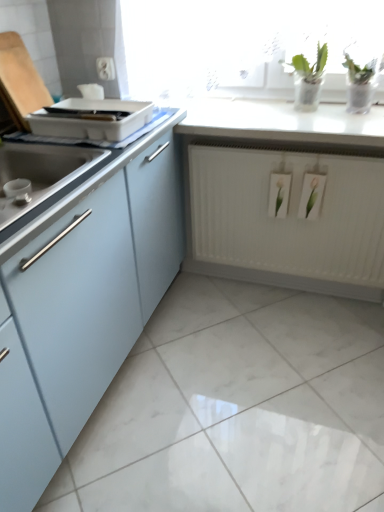
Image resolution: width=384 pixels, height=512 pixels. Describe the element at coordinates (77, 288) in the screenshot. I see `matte light blue cabinet at left` at that location.

At what (x,y) coordinates should I click in order to perform the action: click on matte light blue cabinet at left. Please return your answer as a coordinate pair (x, y). The image size is (384, 512). Looking at the image, I should click on (77, 288).

Between white plastic tray at upper left and white matte radiator at center, which one has larger width?

With larger width is white plastic tray at upper left.

From a real-world perspective, is white plastic tray at upper left below white matte radiator at center?

No.

Is white plastic tray at upper left facing away from white matte radiator at center?

white plastic tray at upper left is not turned away from white matte radiator at center.

Considering the sizes of matte light blue cabinet at left and white glossy countertop at upper center in the image, is matte light blue cabinet at left bigger or smaller than white glossy countertop at upper center?

Clearly, matte light blue cabinet at left is larger in size than white glossy countertop at upper center.

How much distance is there between matte light blue cabinet at left and white glossy countertop at upper center?

They are 26.23 inches apart.

Between matte light blue cabinet at left and white glossy countertop at upper center, which one appears on the right side from the viewer's perspective?

Positioned to the right is white glossy countertop at upper center.

Does matte light blue cabinet at left turn towards white glossy countertop at upper center?

Yes.

How different are the orientations of white matte radiator at center and white glossy countertop at upper center in degrees?

They differ by 1.72 degrees in their facing directions.

Who is shorter, white matte radiator at center or white glossy countertop at upper center?

Standing shorter between the two is white glossy countertop at upper center.

Which of these two, white matte radiator at center or white glossy countertop at upper center, is bigger?

With larger size is white matte radiator at center.

You are a GUI agent. You are given a task and a screenshot of the screen. Output one action in this format:
    pyautogui.click(x=<x>, y=<y>)
    Task: Click on the radiator that is under the white glossy countertop at upper center (from a real-world perspective)
    The height and width of the screenshot is (512, 384).
    Given the screenshot: What is the action you would take?
    pyautogui.click(x=286, y=220)

Based on the photo, from their relative heights in the image, would you say white plastic electric outlet at upper center is taller or shorter than white glossy countertop at upper center?

white plastic electric outlet at upper center is taller than white glossy countertop at upper center.

Is white plastic electric outlet at upper center wider than white glossy countertop at upper center?

In fact, white plastic electric outlet at upper center might be narrower than white glossy countertop at upper center.

Where is `countertop in front of the white plastic electric outlet at upper center`? The height and width of the screenshot is (512, 384). countertop in front of the white plastic electric outlet at upper center is located at coordinates (282, 122).

From the image's perspective, between white matte radiator at center and white plastic tray at upper left, which one is located above?

white plastic tray at upper left is shown above in the image.

Which is nearer, (206, 223) or (107, 140)?

Point (206, 223) is farther from the camera than point (107, 140).

From a real-world perspective, which object rests below the other?

Result: From a 3D spatial view, white matte radiator at center is below.

Is white matte radiator at center outside of white plastic tray at upper left?

white matte radiator at center lies outside white plastic tray at upper left's area.

Is point (99, 129) positioned after point (366, 118)?

No.

Between white plastic tray at upper left and white glossy countertop at upper center, which one appears on the left side from the viewer's perspective?

white plastic tray at upper left is more to the left.

Considering the sizes of objects white plastic tray at upper left and white glossy countertop at upper center in the image provided, who is taller, white plastic tray at upper left or white glossy countertop at upper center?

Standing taller between the two is white plastic tray at upper left.

How different are the orientations of white plastic tray at upper left and white glossy countertop at upper center in degrees?

The angle between the facing direction of white plastic tray at upper left and the facing direction of white glossy countertop at upper center is 89.2 degrees.

From a real-world perspective, is white matte radiator at center below matte light blue cabinet at left?

Yes, from a real-world perspective, white matte radiator at center is below matte light blue cabinet at left.

This screenshot has height=512, width=384. In order to click on radiator above the matte light blue cabinet at left (from the image's perspective) in this screenshot , I will do `click(286, 220)`.

Considering the relative sizes of white matte radiator at center and matte light blue cabinet at left in the image provided, is white matte radiator at center wider than matte light blue cabinet at left?

No, white matte radiator at center is not wider than matte light blue cabinet at left.

Is white matte radiator at center beside matte light blue cabinet at left?

white matte radiator at center and matte light blue cabinet at left are clearly separated.

Where is `radiator behind the white plastic tray at upper left`? This screenshot has height=512, width=384. radiator behind the white plastic tray at upper left is located at coordinates (286, 220).

Where is `cabinetry beneath the white glossy countertop at upper center (from a real-world perspective)`? This screenshot has height=512, width=384. cabinetry beneath the white glossy countertop at upper center (from a real-world perspective) is located at coordinates (77, 288).

Considering their positions, is white plastic electric outlet at upper center positioned further to white glossy countertop at upper center than white matte radiator at center?

The object further to white glossy countertop at upper center is white plastic electric outlet at upper center.

From the image, which object appears to be nearer to white plastic electric outlet at upper center, white glossy countertop at upper center or white plastic tray at upper left?

white plastic tray at upper left lies closer to white plastic electric outlet at upper center than the other object.

Looking at this image, looking at the image, which one is located further to white glossy countertop at upper center, white matte radiator at center or white plastic tray at upper left?

white plastic tray at upper left is positioned further to the anchor white glossy countertop at upper center.

Considering their positions, is white matte radiator at center positioned further to white plastic tray at upper left than white plastic electric outlet at upper center?

white matte radiator at center.

Consider the image. Based on their spatial positions, is white matte radiator at center or white glossy countertop at upper center further from matte light blue cabinet at left?

white matte radiator at center is positioned further to the anchor matte light blue cabinet at left.

Looking at the image, which one is located further to matte light blue cabinet at left, white matte radiator at center or white plastic electric outlet at upper center?

Among the two, white plastic electric outlet at upper center is located further to matte light blue cabinet at left.

Estimate the real-world distances between objects in this image. Which object is closer to white matte radiator at center, white glossy countertop at upper center or white plastic electric outlet at upper center?

white glossy countertop at upper center.

Based on their spatial positions, is matte light blue cabinet at left or white glossy countertop at upper center further from white plastic tray at upper left?

white glossy countertop at upper center is positioned further to the anchor white plastic tray at upper left.

In order to click on appliance positioned between matte light blue cabinet at left and white plastic electric outlet at upper center from near to far in this screenshot , I will do `click(91, 119)`.

Image resolution: width=384 pixels, height=512 pixels. Find the location of `appliance between matte light blue cabinet at left and white matte radiator at center`. appliance between matte light blue cabinet at left and white matte radiator at center is located at coordinates coord(91,119).

Find the location of a particular element. The width and height of the screenshot is (384, 512). countertop between matte light blue cabinet at left and white matte radiator at center is located at coordinates (282, 122).

Where is `countertop between white plastic electric outlet at upper center and white matte radiator at center from left to right`? This screenshot has height=512, width=384. countertop between white plastic electric outlet at upper center and white matte radiator at center from left to right is located at coordinates (282, 122).